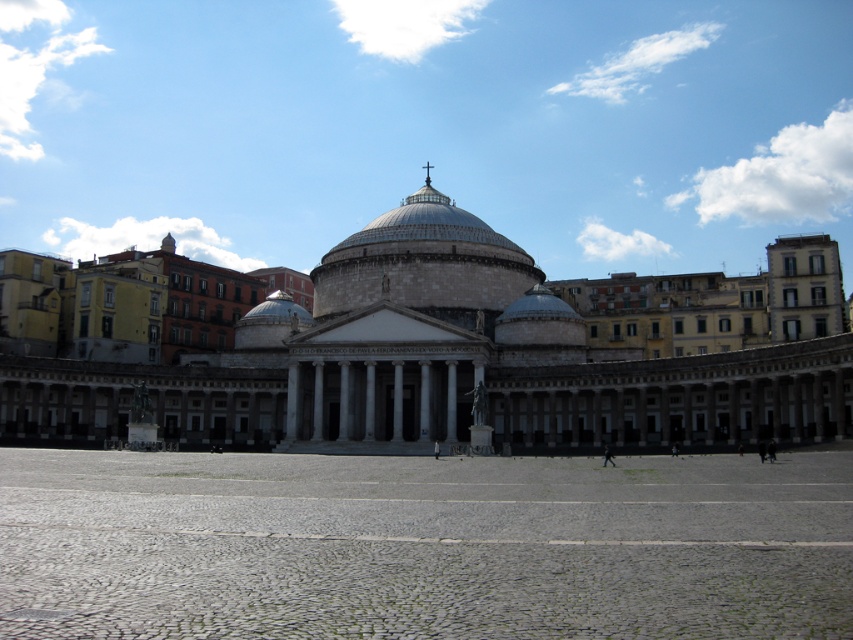
You are standing in the plaza looking at the grand neoclassical building with the dome. There is a specific point marked at coordinates (466, 356). What does this point correspond to?

The point at coordinates (466, 356) corresponds to the white marble building at center.

You are standing in the plaza in front of the grand neoclassical building. You want to take a photo that includes the entire white marble building at center without any cropping. Given that your camera has a standard 50mm lens, which has a 47 degree angle of view, will you be able to fit the entire building into the frame from your current position 79.47 meters away?

The white marble building at center is 79.47 meters away. To determine if it fits in the frame with a 50mm lens and 47 degree angle of view, we can calculate the maximum width that can be captured at that distance. Using the formula for field of view, the maximum width would be approximately 2 x 79.47 x tan 23.5 degrees. Calculating this gives around 2 x 79.47 x 0.436 equals roughly 69.4 meters. If the building is narrower than 69.4 meters, it will fit. However, since the problem doesn t provide the actual

You are standing in the plaza and want to take a photo of the white marble building at center and the white stone dome at center. Which one should you focus on first if you want to capture both in the frame without moving your camera?

The white marble building at center is positioned on the left side of the white stone dome at center, so you should focus on the white marble building at center first to ensure both are in the frame without moving the camera.